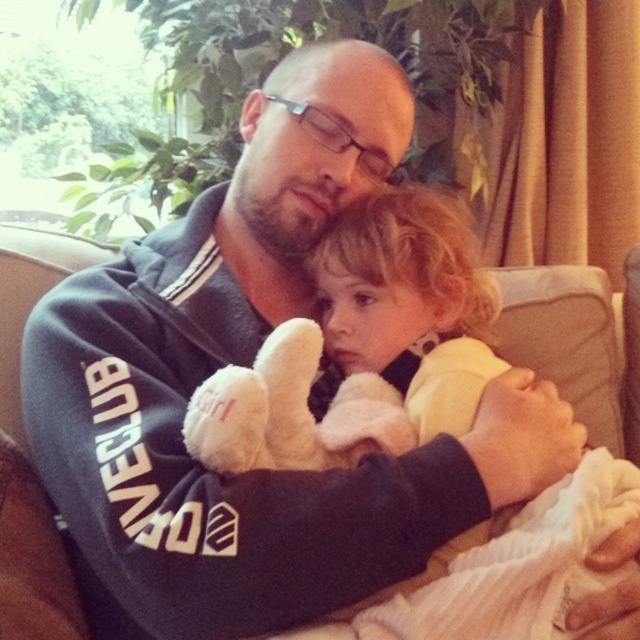
Which is more to the left, soft white teddy bear at center or white plush toy at center?

From the viewer's perspective, white plush toy at center appears more on the left side.

The width and height of the screenshot is (640, 640). I want to click on soft white teddy bear at center, so click(410, 300).

Is point (420, 211) farther from camera compared to point (280, 381)?

That is True.

Identify the location of soft white teddy bear at center. The height and width of the screenshot is (640, 640). (410, 300).